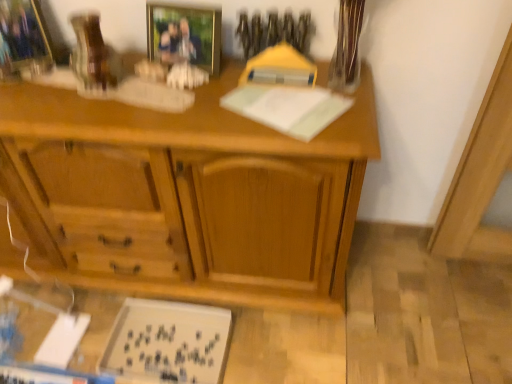
Question: Can you confirm if gold-framed photo at upper center, which is counted as the first picture frame, starting from the right, is thinner than clear glass vase at upper right?

Choices:
 (A) yes
 (B) no

Answer: (A)

Question: Is gold-framed photo at upper center, which is the 2th picture frame from left to right, to the right of clear glass vase at upper right from the viewer's perspective?

Choices:
 (A) yes
 (B) no

Answer: (B)

Question: Does gold-framed photo at upper center, which is the 2th picture frame from left to right, lie behind clear glass vase at upper right?

Choices:
 (A) no
 (B) yes

Answer: (B)

Question: Is gold-framed photo at upper center, which is counted as the first picture frame, starting from the right, at the left side of clear glass vase at upper right?

Choices:
 (A) yes
 (B) no

Answer: (A)

Question: Can you see gold-framed photo at upper center, which is the 2th picture frame from left to right, touching clear glass vase at upper right?

Choices:
 (A) no
 (B) yes

Answer: (A)

Question: In terms of width, does brushed metal picture frame at upper left, placed as the first picture frame when sorted from left to right, look wider or thinner when compared to wooden desk at center?

Choices:
 (A) thin
 (B) wide

Answer: (A)

Question: From a real-world perspective, is brushed metal picture frame at upper left, which ranks as the 2th picture frame in right-to-left order, above or below wooden desk at center?

Choices:
 (A) below
 (B) above

Answer: (B)

Question: Would you say brushed metal picture frame at upper left, placed as the first picture frame when sorted from left to right, is to the left or to the right of wooden desk at center in the picture?

Choices:
 (A) right
 (B) left

Answer: (B)

Question: In terms of height, does brushed metal picture frame at upper left, placed as the first picture frame when sorted from left to right, look taller or shorter compared to wooden desk at center?

Choices:
 (A) tall
 (B) short

Answer: (B)

Question: Is white matte board at lower left situated inside clear glass vase at upper right or outside?

Choices:
 (A) outside
 (B) inside

Answer: (A)

Question: From the image's perspective, is white matte board at lower left located above or below clear glass vase at upper right?

Choices:
 (A) above
 (B) below

Answer: (B)

Question: Visually, is white matte board at lower left positioned to the left or to the right of clear glass vase at upper right?

Choices:
 (A) right
 (B) left

Answer: (B)

Question: Based on their sizes in the image, would you say white matte board at lower left is bigger or smaller than clear glass vase at upper right?

Choices:
 (A) small
 (B) big

Answer: (B)

Question: Is point (172, 46) closer or farther from the camera than point (32, 61)?

Choices:
 (A) farther
 (B) closer

Answer: (B)

Question: From the image's perspective, is gold-framed photo at upper center, which is counted as the first picture frame, starting from the right, located above or below brushed metal picture frame at upper left, which ranks as the 2th picture frame in right-to-left order?

Choices:
 (A) above
 (B) below

Answer: (B)